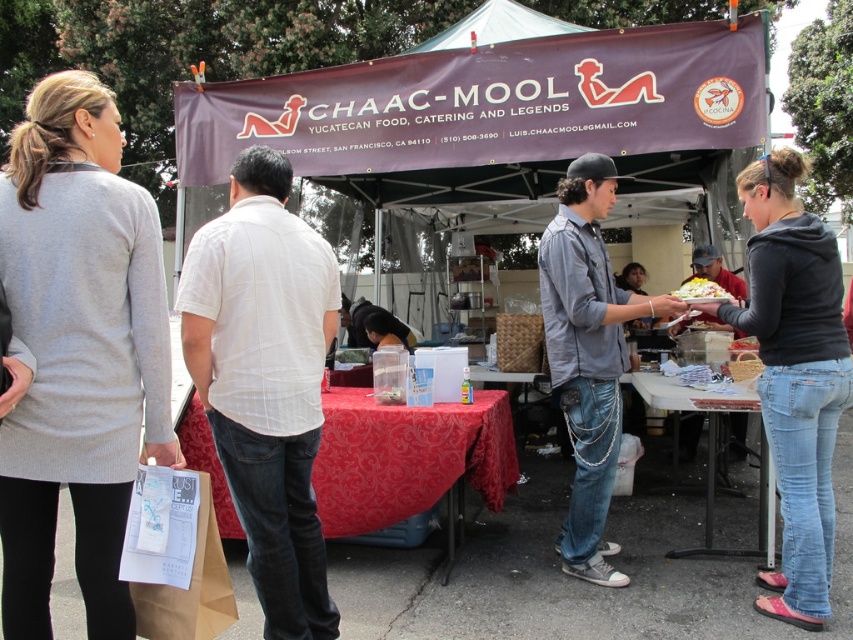
Question: Which object is closer to the camera taking this photo?

Choices:
 (A) shiny yellow salad at center
 (B) light gray sweater at upper left

Answer: (B)

Question: Considering the real-world distances, which object is farthest from the maroon fabric canopy at center?

Choices:
 (A) denim jeans at center
 (B) shiny yellow salad at center
 (C) dark gray hoodie at center
 (D) wooden table at lower center

Answer: (D)

Question: Is matte gray shirt at center above shiny yellow salad at center?

Choices:
 (A) yes
 (B) no

Answer: (A)

Question: From the image, what is the correct spatial relationship of dark gray hoodie at center in relation to shiny yellow salad at center?

Choices:
 (A) left
 (B) right

Answer: (B)

Question: Among these objects, which one is farthest from the camera?

Choices:
 (A) red damask tablecloth at center
 (B) shiny yellow salad at center
 (C) maroon fabric canopy at center

Answer: (C)

Question: Can you confirm if dark gray hoodie at center is positioned to the left of denim jeans at center?

Choices:
 (A) yes
 (B) no

Answer: (B)